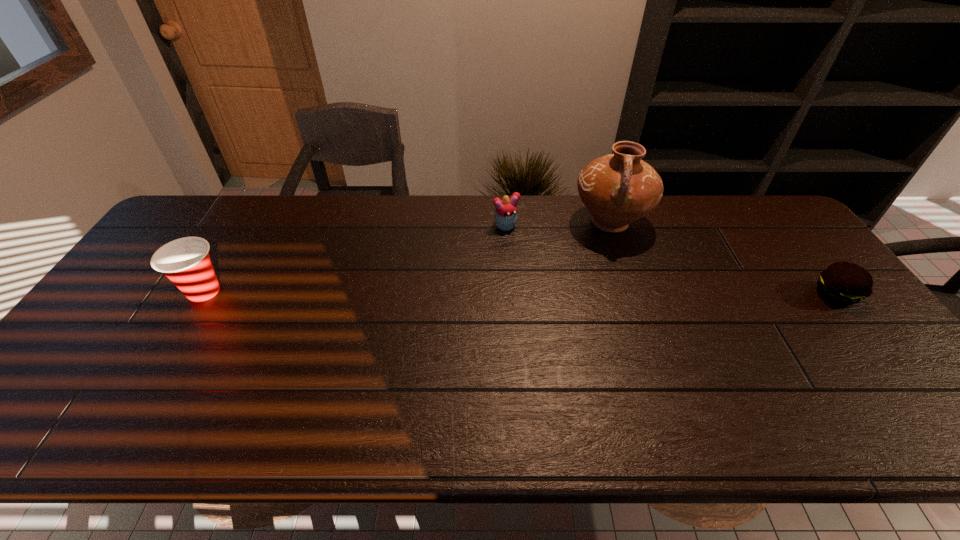
Identify the location of empty space between the second shortest object and the shortest object. This screenshot has width=960, height=540. (671, 260).

At what (x,y) coordinates should I click in order to perform the action: click on free space between the tallest object and the leftmost object. Please return your answer as a coordinate pair (x, y). The height and width of the screenshot is (540, 960). Looking at the image, I should click on (407, 257).

At what (x,y) coordinates should I click in order to perform the action: click on free space between the second tallest object and the tallest object. Please return your answer as a coordinate pair (x, y). This screenshot has height=540, width=960. Looking at the image, I should click on (407, 257).

The height and width of the screenshot is (540, 960). What are the coordinates of `free point between the cupcake and the shortest object` in the screenshot? It's located at (671, 260).

I want to click on unoccupied position between the second object from right to left and the third object from right to left, so click(559, 224).

Locate an element on the screen. This screenshot has width=960, height=540. object that is the third closest to the third shortest object is located at coordinates (842, 283).

I want to click on object that is the second closest to the third shortest object, so click(x=617, y=189).

Find the location of a particular element. This screenshot has width=960, height=540. vacant area that satisfies the following two spatial constraints: 1. on the back side of the tallest object; 2. on the right side of the leftmost object is located at coordinates (246, 222).

Locate an element on the screen. This screenshot has width=960, height=540. free space that satisfies the following two spatial constraints: 1. on the front side of the patty; 2. on the right side of the third object from right to left is located at coordinates (511, 295).